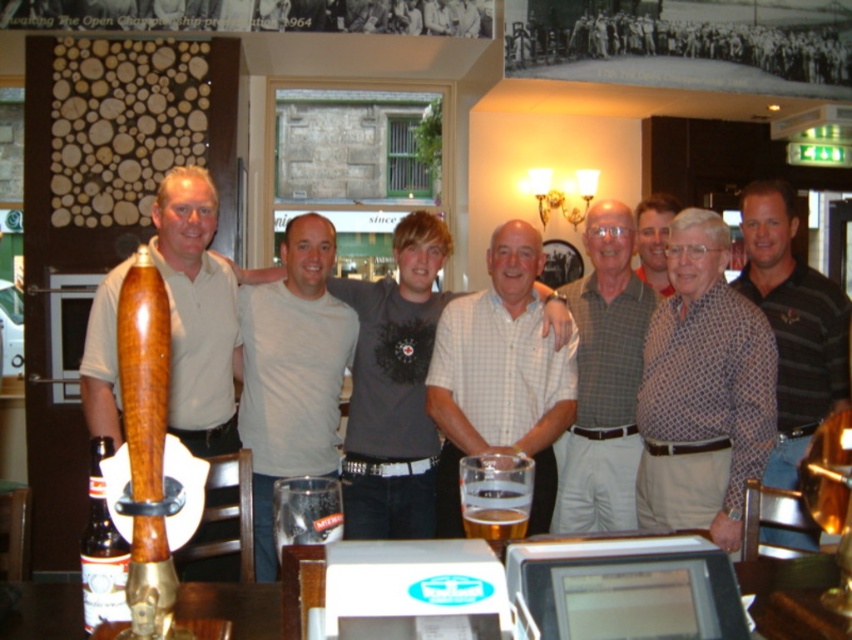
You are a photographer who wants to ensure all subjects in the group photo are clearly visible. Considering the wooden tap handle at center and the matte red shirt at center, which object might obstruct the view of the other?

The wooden tap handle at center is bigger than the matte red shirt at center, so it might obstruct the view of the matte red shirt at center.

You are a bartender trying to place a dark brown glass bottle at lower left and a matte red shirt at center on a narrow shelf. Which object should you choose to fit better on the shelf?

Answer: The dark brown glass bottle at lower left is thinner than the matte red shirt at center, so it will fit better on the narrow shelf.

You are standing in the pub where the group is taking a photo. You want to move from the beer tap to the stone building outside. Which direction should you go through the path between point (91, 458) and point (660, 252)?

The path between point (91, 458) and point (660, 252) leads towards the stone building outside, so you should go through that path.